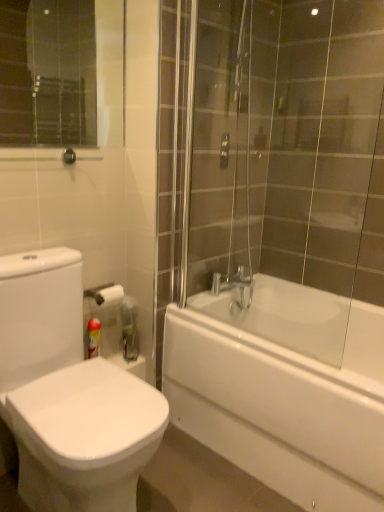
Question: From the image's perspective, would you say white glossy bidet at lower left is shown under red plastic can at lower left?

Choices:
 (A) no
 (B) yes

Answer: (B)

Question: Can you confirm if white glossy bidet at lower left is thinner than red plastic can at lower left?

Choices:
 (A) yes
 (B) no

Answer: (B)

Question: Does white glossy bidet at lower left have a smaller size compared to red plastic can at lower left?

Choices:
 (A) yes
 (B) no

Answer: (B)

Question: Can you confirm if white glossy bidet at lower left is taller than red plastic can at lower left?

Choices:
 (A) no
 (B) yes

Answer: (B)

Question: Is white glossy bidet at lower left wider than red plastic can at lower left?

Choices:
 (A) no
 (B) yes

Answer: (B)

Question: Can red plastic can at lower left be found inside white glossy bidet at lower left?

Choices:
 (A) yes
 (B) no

Answer: (B)

Question: From a real-world perspective, is white glossy bathtub at right physically below red plastic can at lower left?

Choices:
 (A) yes
 (B) no

Answer: (A)

Question: Can you confirm if white glossy bathtub at right is bigger than red plastic can at lower left?

Choices:
 (A) yes
 (B) no

Answer: (A)

Question: Does white glossy bathtub at right appear on the right side of red plastic can at lower left?

Choices:
 (A) no
 (B) yes

Answer: (B)

Question: Does white glossy bathtub at right have a lesser height compared to red plastic can at lower left?

Choices:
 (A) yes
 (B) no

Answer: (B)

Question: Does white glossy bathtub at right lie in front of red plastic can at lower left?

Choices:
 (A) yes
 (B) no

Answer: (A)

Question: Is red plastic can at lower left located within white glossy bathtub at right?

Choices:
 (A) yes
 (B) no

Answer: (B)

Question: Is red plastic can at lower left located outside white glossy bidet at lower left?

Choices:
 (A) yes
 (B) no

Answer: (A)